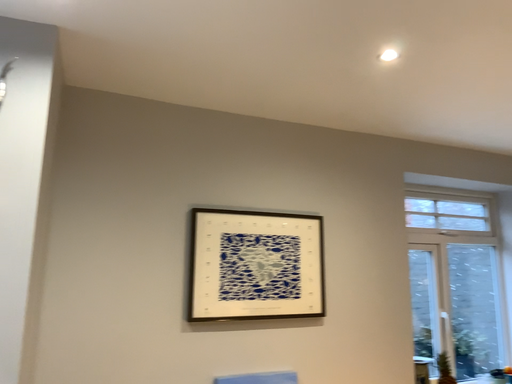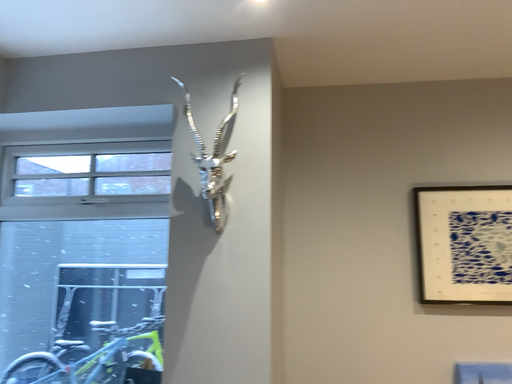
Question: How did the camera likely rotate when shooting the video?

Choices:
 (A) rotated right
 (B) rotated left

Answer: (B)